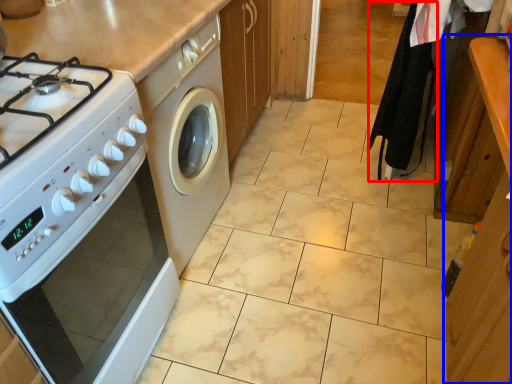
Question: Which object is closer to the camera taking this photo, robe (highlighted by a red box) or cabinetry (highlighted by a blue box)?

Choices:
 (A) robe
 (B) cabinetry

Answer: (B)